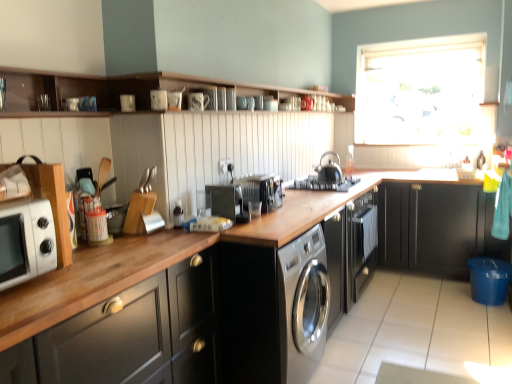
Question: Should I look upward or downward to see black matte cabinet at right, positioned as the third cabinetry in left-to-right order?

Choices:
 (A) down
 (B) up

Answer: (A)

Question: Does matte wood cabinet at left, acting as the third cabinetry starting from the right, have a greater height compared to white glossy microwave at left?

Choices:
 (A) no
 (B) yes

Answer: (B)

Question: Does matte wood cabinet at left, the 1th cabinetry from the bottom, touch white glossy microwave at left?

Choices:
 (A) no
 (B) yes

Answer: (A)

Question: Can you confirm if matte wood cabinet at left, arranged as the 3th cabinetry when viewed from the top, is positioned to the left of white glossy microwave at left?

Choices:
 (A) yes
 (B) no

Answer: (B)

Question: From a real-world perspective, is matte wood cabinet at left, acting as the third cabinetry starting from the right, over white glossy microwave at left?

Choices:
 (A) no
 (B) yes

Answer: (A)

Question: Is matte wood cabinet at left, the first cabinetry in the left-to-right sequence, behind white glossy microwave at left?

Choices:
 (A) no
 (B) yes

Answer: (A)

Question: Is black matte kettle at center, arranged as the third appliance when viewed from the front, located outside satin silver toaster at center, which appears as the 2th appliance when viewed from the back?

Choices:
 (A) no
 (B) yes

Answer: (B)

Question: Considering the relative sizes of black matte kettle at center, the first appliance from the right, and satin silver toaster at center, which appears as the 2th appliance when viewed from the back, in the image provided, is black matte kettle at center, the first appliance from the right, taller than satin silver toaster at center, which appears as the 2th appliance when viewed from the back,?

Choices:
 (A) yes
 (B) no

Answer: (A)

Question: From the image's perspective, is black matte kettle at center, arranged as the third appliance when viewed from the front, below satin silver toaster at center, arranged as the second appliance when viewed from the front?

Choices:
 (A) no
 (B) yes

Answer: (A)

Question: Considering the relative sizes of black matte kettle at center, the first appliance from the right, and satin silver toaster at center, arranged as the second appliance when viewed from the front, in the image provided, is black matte kettle at center, the first appliance from the right, bigger than satin silver toaster at center, arranged as the second appliance when viewed from the front,?

Choices:
 (A) no
 (B) yes

Answer: (A)

Question: Considering the relative sizes of black matte kettle at center, the first appliance positioned from the back, and satin silver toaster at center, which ranks as the second appliance in right-to-left order, in the image provided, is black matte kettle at center, the first appliance positioned from the back, wider than satin silver toaster at center, which ranks as the second appliance in right-to-left order,?

Choices:
 (A) yes
 (B) no

Answer: (B)

Question: Is satin silver toaster at center, acting as the 2th appliance starting from the left, at the back of black matte kettle at center, the first appliance from the right?

Choices:
 (A) yes
 (B) no

Answer: (B)

Question: Does white glossy microwave at left turn towards satin black stove at center?

Choices:
 (A) yes
 (B) no

Answer: (B)